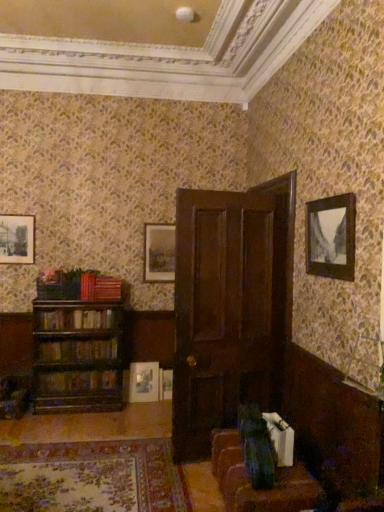
At what (x,y) coordinates should I click in order to perform the action: click on free location above wooden bookshelf at left, which is counted as the 2th book, starting from the bottom (from a real-world perspective). Please return your answer as a coordinate pair (x, y). Image resolution: width=384 pixels, height=512 pixels. Looking at the image, I should click on (85, 335).